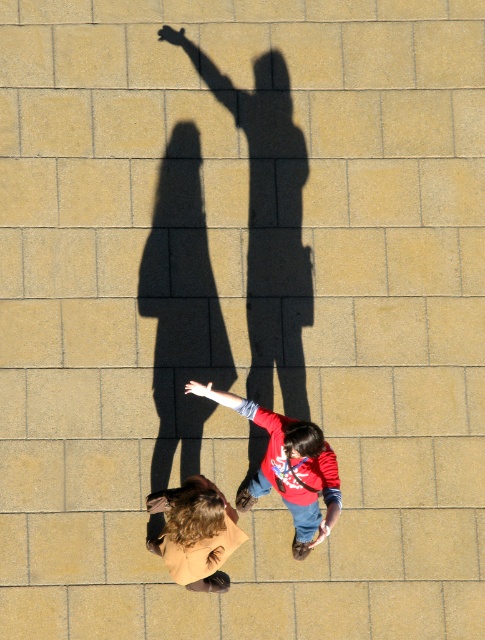
Is smooth black hand at upper center wider than light skin tone flesh at lower center?

Correct, the width of smooth black hand at upper center exceeds that of light skin tone flesh at lower center.

Based on the photo, is smooth black hand at upper center closer to the viewer compared to light skin tone flesh at lower center?

No, it is behind light skin tone flesh at lower center.

Locate an element on the screen. smooth black hand at upper center is located at coordinates coord(173,35).

Is matte black arm at upper center positioned behind matte red arm at center?

Yes, it is.

Is point (182, 35) farther from camera compared to point (207, 387)?

Yes, it is behind point (207, 387).

Where is `matte black arm at upper center`? The image size is (485, 640). matte black arm at upper center is located at coordinates (210, 74).

Can you confirm if red cotton shirt at lower center is positioned to the left of smooth black hand at upper center?

In fact, red cotton shirt at lower center is to the right of smooth black hand at upper center.

Consider the image. Is red cotton shirt at lower center positioned in front of smooth black hand at upper center?

Yes, it is in front of smooth black hand at upper center.

Is point (226, 392) less distant than point (180, 36)?

Yes, point (226, 392) is closer to viewer.

Where is `red cotton shirt at lower center`? The height and width of the screenshot is (640, 485). red cotton shirt at lower center is located at coordinates (291, 467).